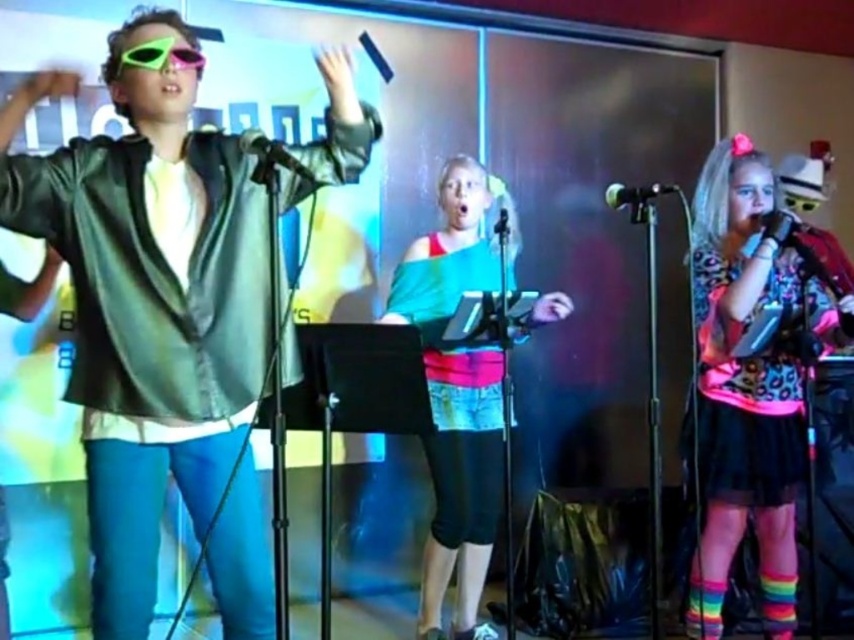
You are a stagehand adjusting the lighting for the performance. You need to reach both the neon plastic sunglasses at upper left and the green matte microphone at center. Which object will you need to move closer to the audience to align them at the same distance?

The neon plastic sunglasses at upper left is closer to the viewer than the green matte microphone at center. To align them at the same distance, you would need to move the green matte microphone at center closer to the audience so it matches the position of the neon plastic sunglasses at upper left.

You are a sound technician adjusting the microphones for the performance. The metallic silver microphone at right and the green matte microphone at center are both needed for the upcoming act. Based on their positions, which microphone is closer to the floor?

The metallic silver microphone at right is positioned below the green matte microphone at center, so it is closer to the floor.

Based on the scene description, can you determine which object is taller between the multicolored fabric dress at center and the neon plastic sunglasses at upper left?

The multicolored fabric dress at center is much taller than the neon plastic sunglasses at upper left.